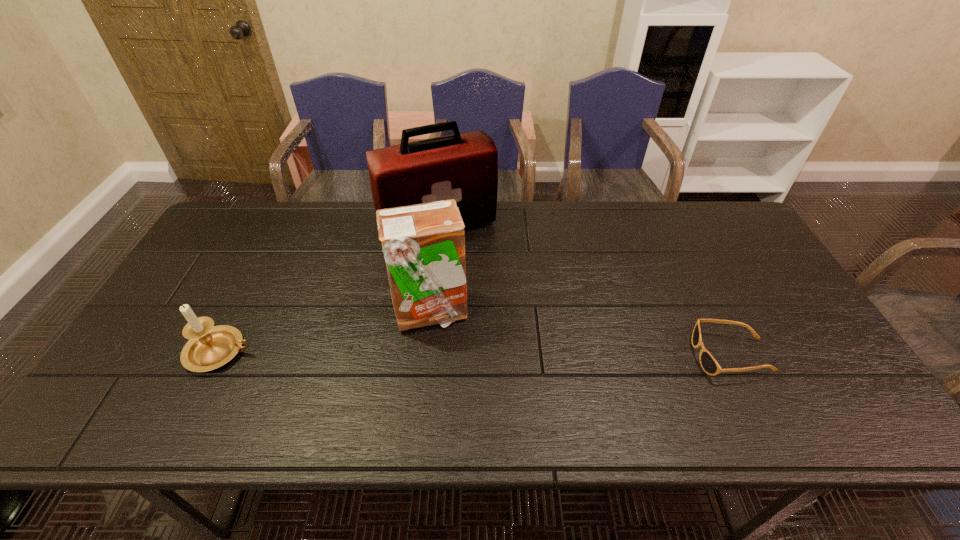
Find the location of a particular element. This screenshot has height=540, width=960. vacant space situated 0.300m on the straw side of the carton is located at coordinates (563, 382).

Find the location of a particular element. This screenshot has height=540, width=960. vacant point located on the straw side of the carton is located at coordinates (574, 388).

Find the location of a particular element. This screenshot has height=540, width=960. vacant space located on the straw side of the carton is located at coordinates (534, 365).

Where is `free region located 0.330m on the side of the first aid kit with the cross symbol`? free region located 0.330m on the side of the first aid kit with the cross symbol is located at coordinates (499, 328).

Where is `vacant position located on the side of the first aid kit with the cross symbol`? vacant position located on the side of the first aid kit with the cross symbol is located at coordinates (490, 309).

Locate an element on the screen. Image resolution: width=960 pixels, height=540 pixels. free space located on the side of the first aid kit with the cross symbol is located at coordinates (503, 333).

I want to click on object at the far edge, so click(x=464, y=166).

Find the location of a particular element. This screenshot has height=540, width=960. candle holder at the near edge is located at coordinates (210, 347).

Image resolution: width=960 pixels, height=540 pixels. I want to click on sunglasses that is at the near edge, so click(710, 366).

Where is `object that is at the left edge`? object that is at the left edge is located at coordinates (210, 347).